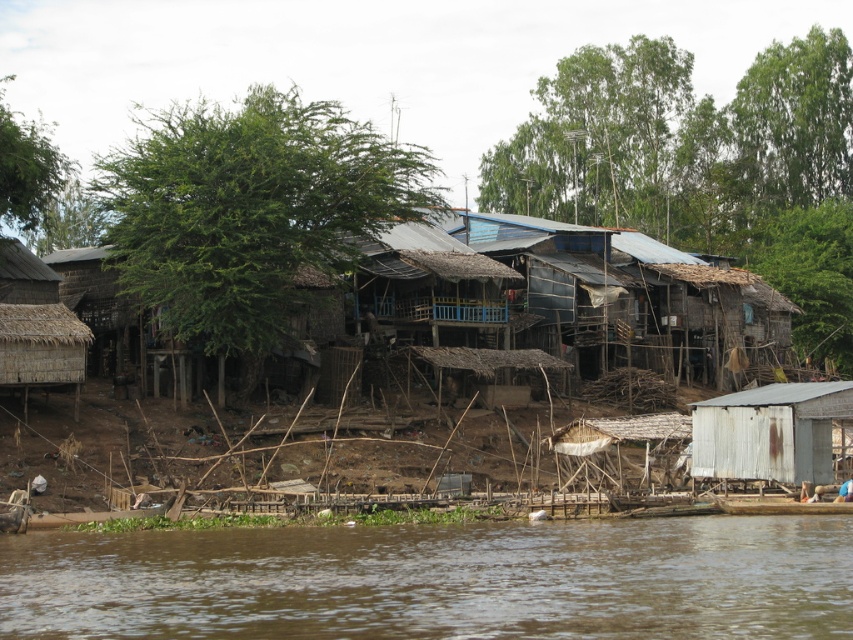
You are standing on a path near the white weathered shack at lower right and want to cross to the other side. Is the brown muddy water at lower center between you and your destination?

The brown muddy water at lower center is to the left of the white weathered shack at lower right, so if you are standing near the shack and want to cross to the other side, the muddy water is not directly in your path. You might need to go around it to reach the opposite side.

You are standing at the point labeled as point (438, 580) in the riverside settlement. What type of surface are you currently standing on?

The point (438, 580) is on brown muddy water at lower center, so you are standing on brown muddy water at lower center.